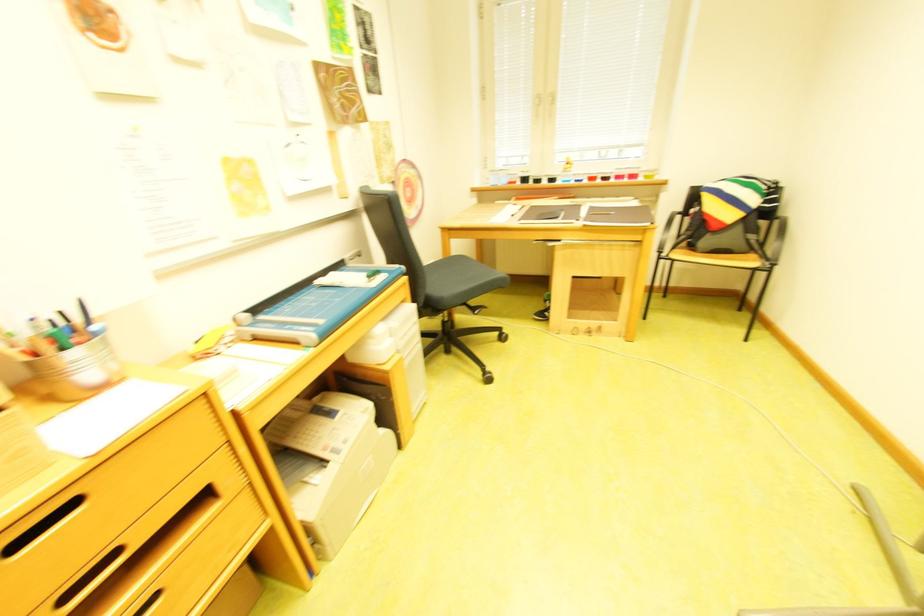
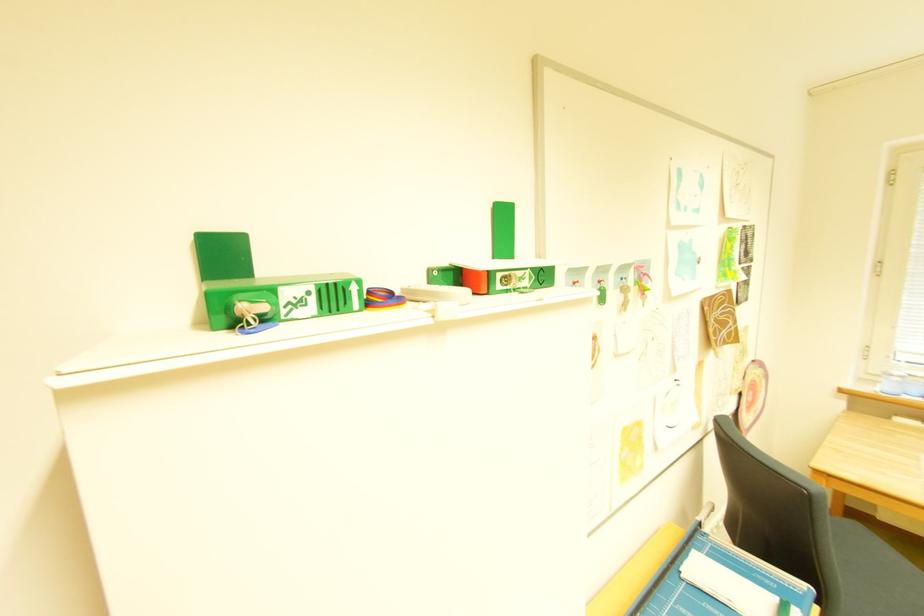
Question: The camera is either moving clockwise (left) or counter-clockwise (right) around the object. The first image is from the beginning of the video and the second image is from the end. Is the camera moving left or right when shooting the video?

Choices:
 (A) Left
 (B) Right

Answer: (B)